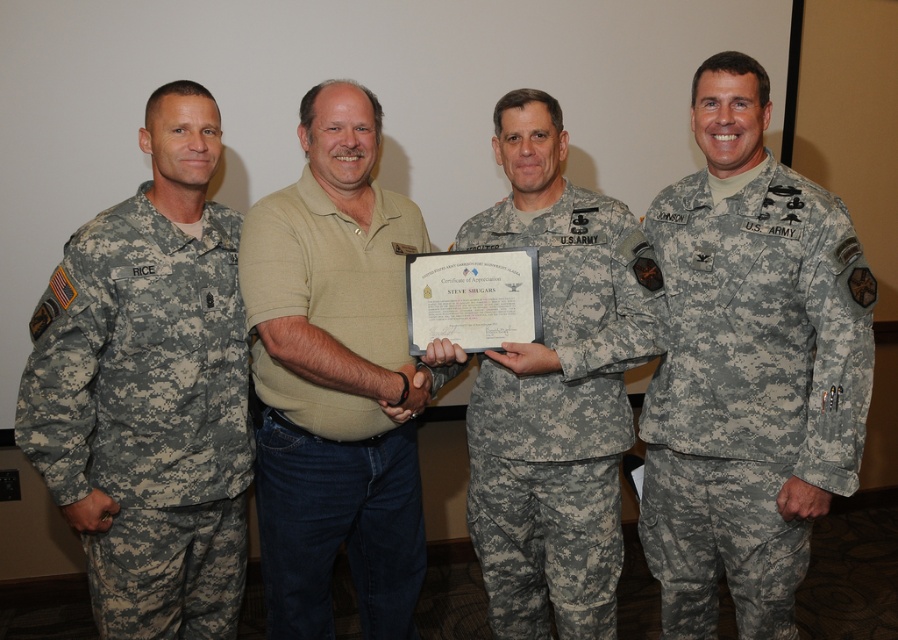
You are a photographer standing in front of the group. You need to adjust the camera focus to capture both the camouflage fabric uniform at right and the camouflage fabric uniform at center clearly. What is the minimum distance the camera lens should be set to ensure both are in focus?

The minimum distance the camera lens should be set to ensure both the camouflage fabric uniform at right and the camouflage fabric uniform at center are in focus is 8.89 inches.

You are a photographer setting up for a group photo. You need to ensure there is enough space between the camouflage fabric uniform at right and the camouflage fabric uniform at left for a 3 feet wide banner to be placed between them. Can you fit the banner between them?

The camouflage fabric uniform at right is 3.28 feet from the camouflage fabric uniform at left, so yes, the banner can be placed between them as the distance is sufficient.